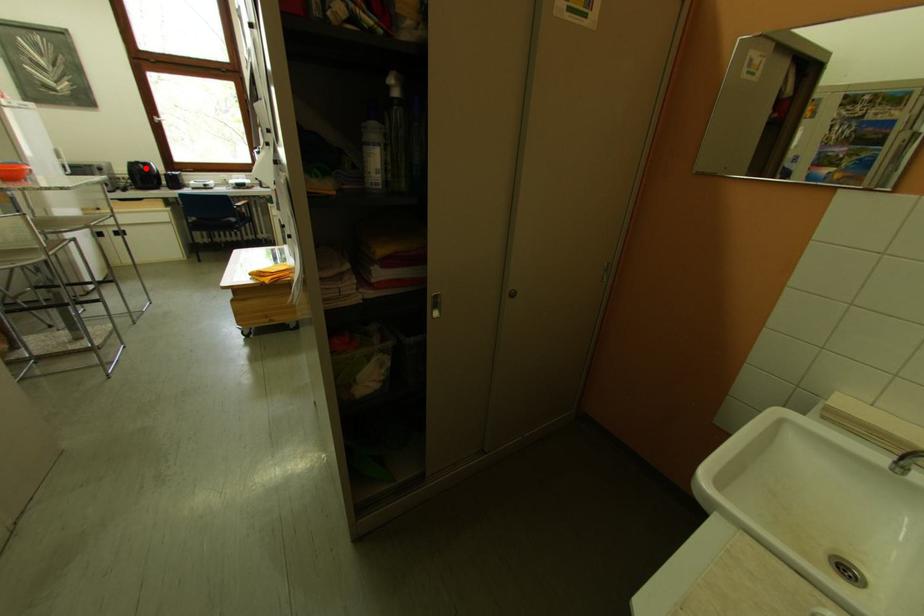
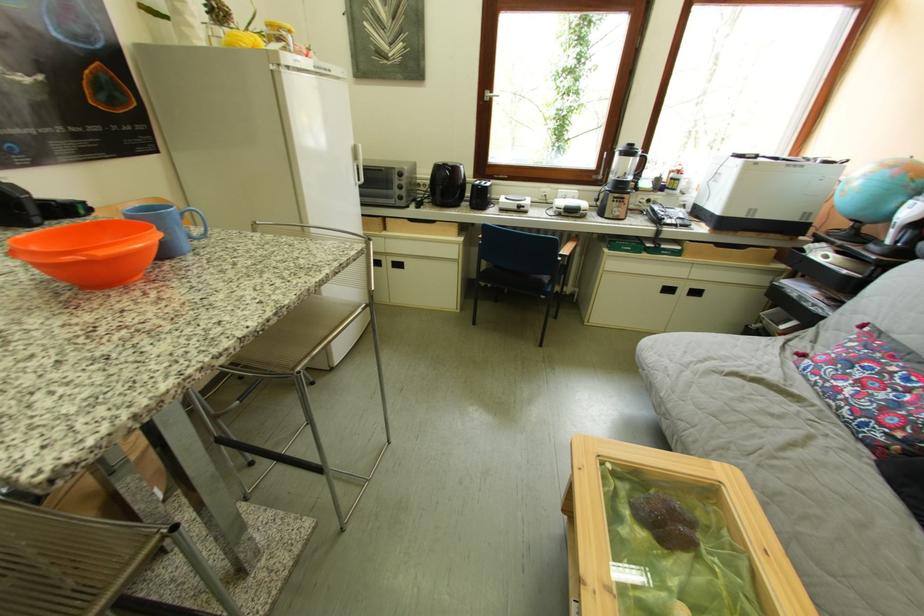
Find the pixel in the second image that matches the highlighted location in the first image.

(451, 171)